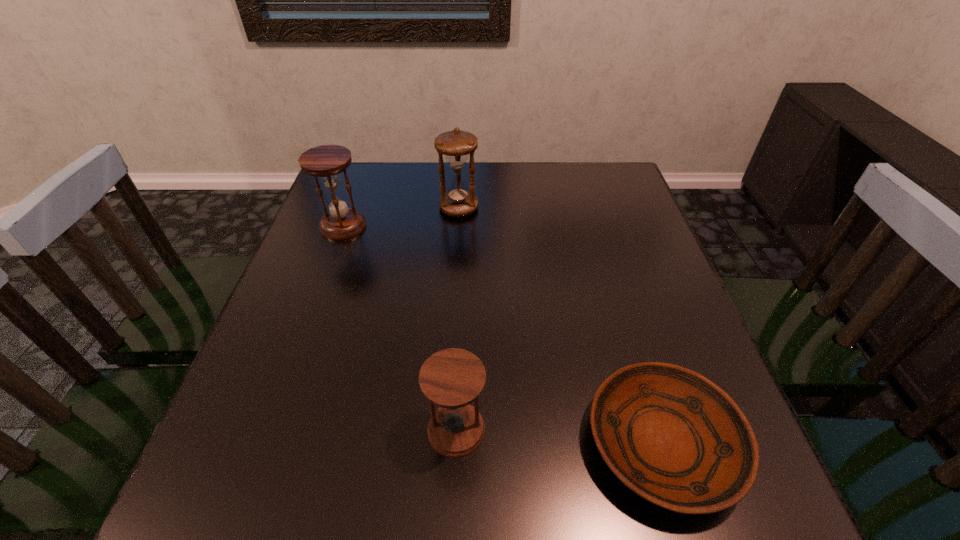
Where is `object present at the left edge`? This screenshot has width=960, height=540. object present at the left edge is located at coordinates (326, 161).

What are the coordinates of `object located at the right edge` in the screenshot? It's located at (673, 437).

Locate an element on the screen. object at the near right corner is located at coordinates (673, 437).

Find the location of `vacant space at the far edge`. vacant space at the far edge is located at coordinates (480, 164).

At what (x,y) coordinates should I click in order to perform the action: click on free location at the near edge. Please return your answer as a coordinate pair (x, y). Looking at the image, I should click on (419, 504).

In order to click on vacant area at the left edge in this screenshot , I will do `click(326, 368)`.

Image resolution: width=960 pixels, height=540 pixels. In order to click on free point at the far left corner in this screenshot , I will do `click(360, 168)`.

The width and height of the screenshot is (960, 540). I want to click on free space at the near left corner of the desktop, so click(x=297, y=494).

I want to click on free area in between the second shortest object and the leftmost hourglass, so click(400, 328).

You are a GUI agent. You are given a task and a screenshot of the screen. Output one action in this format:
    pyautogui.click(x=<x>, y=<y>)
    Task: Click on the vacant region between the leftmost object and the second shortest object
    
    Given the screenshot: What is the action you would take?
    pyautogui.click(x=400, y=328)